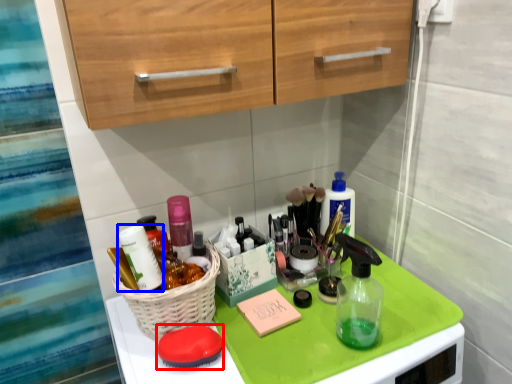
Question: Which object is further to the camera taking this photo, soap (highlighted by a red box) or toiletry (highlighted by a blue box)?

Choices:
 (A) soap
 (B) toiletry

Answer: (B)